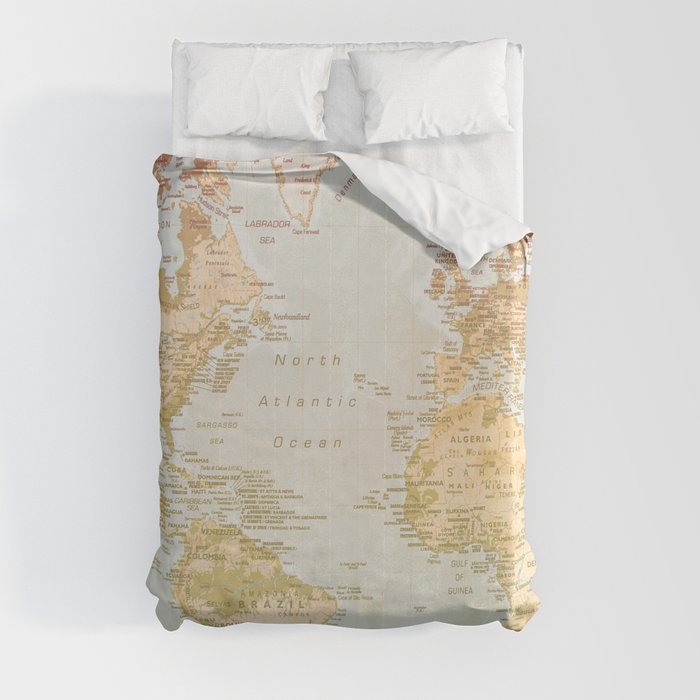
Image resolution: width=700 pixels, height=700 pixels. What are the coordinates of `space between pillow` in the screenshot? It's located at (341, 103).